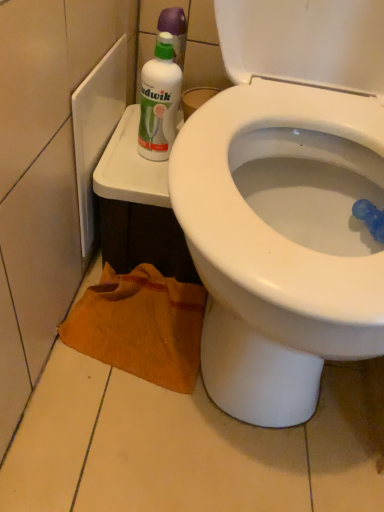
Question: Can you confirm if white plastic bottle at upper left is smaller than white glossy bidet at upper right?

Choices:
 (A) no
 (B) yes

Answer: (B)

Question: Is white plastic bottle at upper left thinner than white glossy bidet at upper right?

Choices:
 (A) yes
 (B) no

Answer: (A)

Question: Does white plastic bottle at upper left appear on the left side of white glossy bidet at upper right?

Choices:
 (A) yes
 (B) no

Answer: (A)

Question: Are white plastic bottle at upper left and white glossy bidet at upper right far apart?

Choices:
 (A) yes
 (B) no

Answer: (B)

Question: Is the depth of white plastic bottle at upper left greater than that of white glossy bidet at upper right?

Choices:
 (A) no
 (B) yes

Answer: (B)

Question: From a real-world perspective, is white glossy bidet at upper right physically located above or below white plastic bottle at upper left?

Choices:
 (A) below
 (B) above

Answer: (A)

Question: Considering their positions, is white glossy bidet at upper right located in front of or behind white plastic bottle at upper left?

Choices:
 (A) behind
 (B) front

Answer: (B)

Question: Would you say white glossy bidet at upper right is inside or outside white plastic bottle at upper left?

Choices:
 (A) outside
 (B) inside

Answer: (A)

Question: From the image's perspective, is white glossy bidet at upper right positioned above or below white plastic bottle at upper left?

Choices:
 (A) above
 (B) below

Answer: (B)

Question: Considering the positions of brown fabric towel at lower left and white plastic bottle at upper left in the image, is brown fabric towel at lower left bigger or smaller than white plastic bottle at upper left?

Choices:
 (A) small
 (B) big

Answer: (B)

Question: Is brown fabric towel at lower left wider or thinner than white plastic bottle at upper left?

Choices:
 (A) thin
 (B) wide

Answer: (B)

Question: From the image's perspective, is brown fabric towel at lower left above or below white plastic bottle at upper left?

Choices:
 (A) above
 (B) below

Answer: (B)

Question: From a real-world perspective, is brown fabric towel at lower left physically located above or below white plastic bottle at upper left?

Choices:
 (A) above
 (B) below

Answer: (B)

Question: Based on their sizes in the image, would you say white plastic bottle at upper left is bigger or smaller than brown fabric towel at lower left?

Choices:
 (A) big
 (B) small

Answer: (B)

Question: Do you think white plastic bottle at upper left is within brown fabric towel at lower left, or outside of it?

Choices:
 (A) inside
 (B) outside

Answer: (B)